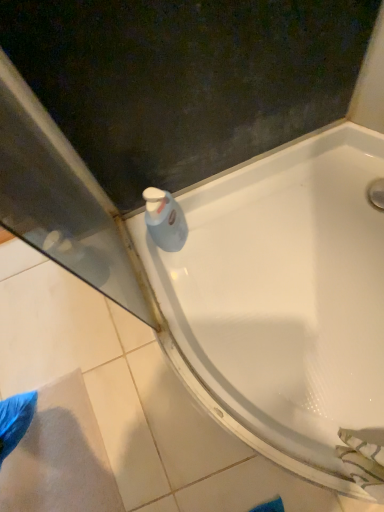
Measure the distance between white glossy bathtub at upper center and camera.

white glossy bathtub at upper center is 30.05 inches from camera.

In order to face white glossy bathtub at upper center, should I rotate leftwards or rightwards?

Rotate your view left by about 7.423°.

The width and height of the screenshot is (384, 512). What do you see at coordinates (282, 301) in the screenshot?
I see `white glossy bathtub at upper center` at bounding box center [282, 301].

You are a GUI agent. You are given a task and a screenshot of the screen. Output one action in this format:
    pyautogui.click(x=<x>, y=<y>)
    Task: Click on the white glossy bathtub at upper center
    The height and width of the screenshot is (512, 384).
    Given the screenshot: What is the action you would take?
    pyautogui.click(x=282, y=301)

Identify the location of white glossy bathtub at upper center. pos(282,301).